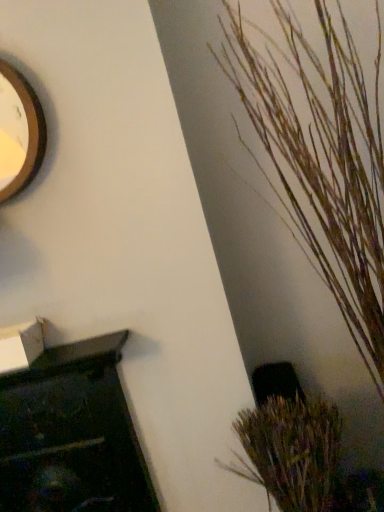
Question: Is wooden clock at upper left surrounded by brown textured plant at lower right, the first houseplant from the bottom?

Choices:
 (A) yes
 (B) no

Answer: (B)

Question: Is brown textured plant at lower right, which appears as the 2th houseplant when viewed from the top, at the left side of wooden clock at upper left?

Choices:
 (A) yes
 (B) no

Answer: (B)

Question: Is brown textured plant at lower right, which appears as the 2th houseplant when viewed from the top, at the right side of wooden clock at upper left?

Choices:
 (A) no
 (B) yes

Answer: (B)

Question: From the image's perspective, is brown textured plant at lower right, the first houseplant from the bottom, under wooden clock at upper left?

Choices:
 (A) yes
 (B) no

Answer: (A)

Question: From a real-world perspective, is brown textured plant at lower right, which appears as the 2th houseplant when viewed from the top, located beneath wooden clock at upper left?

Choices:
 (A) no
 (B) yes

Answer: (B)

Question: From their relative heights in the image, would you say wooden clock at upper left is taller or shorter than brown textured plant at lower right, the first houseplant from the bottom?

Choices:
 (A) short
 (B) tall

Answer: (A)

Question: From the image's perspective, is wooden clock at upper left located above or below brown textured plant at lower right, which appears as the 2th houseplant when viewed from the top?

Choices:
 (A) below
 (B) above

Answer: (B)

Question: Looking at their shapes, would you say wooden clock at upper left is wider or thinner than brown textured plant at lower right, the first houseplant from the bottom?

Choices:
 (A) wide
 (B) thin

Answer: (B)

Question: Is wooden clock at upper left in front of or behind brown textured plant at lower right, which appears as the 2th houseplant when viewed from the top, in the image?

Choices:
 (A) front
 (B) behind

Answer: (B)

Question: Considering the positions of brown textured plant at lower right, the first houseplant from the bottom, and wooden clock at upper left in the image, is brown textured plant at lower right, the first houseplant from the bottom, wider or thinner than wooden clock at upper left?

Choices:
 (A) wide
 (B) thin

Answer: (A)

Question: Is brown textured plant at lower right, which appears as the 2th houseplant when viewed from the top, in front of or behind wooden clock at upper left in the image?

Choices:
 (A) front
 (B) behind

Answer: (A)

Question: In the image, is brown textured plant at lower right, the first houseplant from the bottom, on the left side or the right side of wooden clock at upper left?

Choices:
 (A) left
 (B) right

Answer: (B)

Question: Based on their sizes in the image, would you say brown textured plant at lower right, which appears as the 2th houseplant when viewed from the top, is bigger or smaller than wooden clock at upper left?

Choices:
 (A) big
 (B) small

Answer: (A)

Question: Is point (294, 492) positioned closer to the camera than point (344, 307)?

Choices:
 (A) closer
 (B) farther

Answer: (A)

Question: In terms of width, does brown textured plant at lower right, which appears as the 2th houseplant when viewed from the top, look wider or thinner when compared to wooden textured plant at right, which ranks as the 2th houseplant in bottom-to-top order?

Choices:
 (A) wide
 (B) thin

Answer: (B)